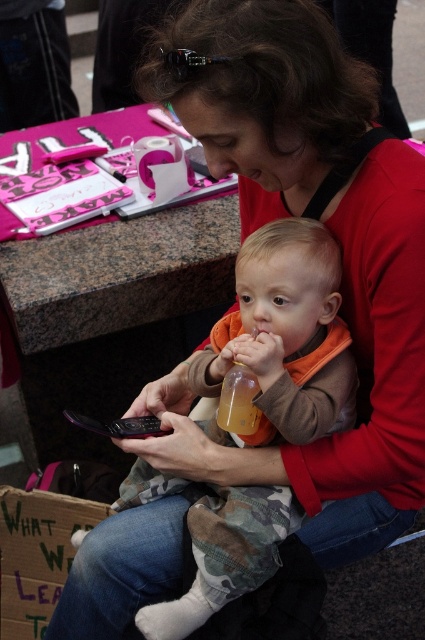
Between orange soft fabric baby at center and translucent plastic bottle at center, which one is positioned lower?

orange soft fabric baby at center is below.

Does orange soft fabric baby at center appear over translucent plastic bottle at center?

Actually, orange soft fabric baby at center is below translucent plastic bottle at center.

Find the location of a particular element. orange soft fabric baby at center is located at coordinates (285, 337).

Identify the location of orange soft fabric baby at center. This screenshot has height=640, width=425. (285, 337).